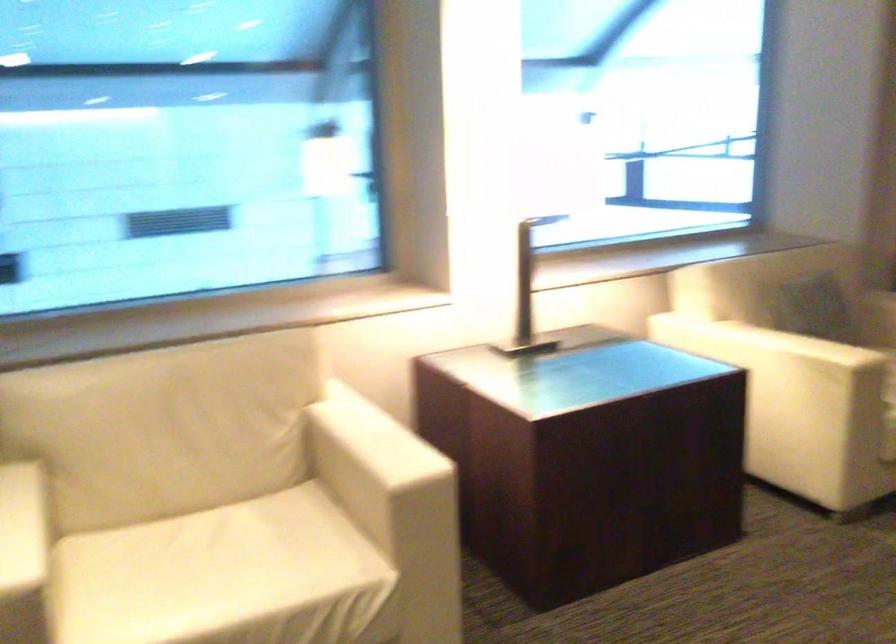
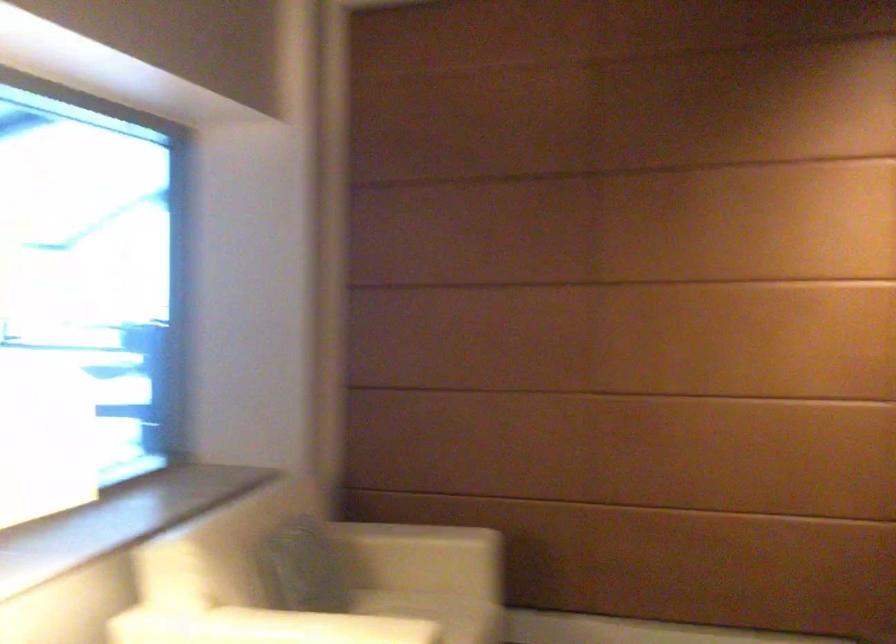
Question: The images are taken continuously from a first-person perspective. In which direction is your viewpoint rotating?

Choices:
 (A) Left
 (B) Right
 (C) Up
 (D) Down

Answer: (B)